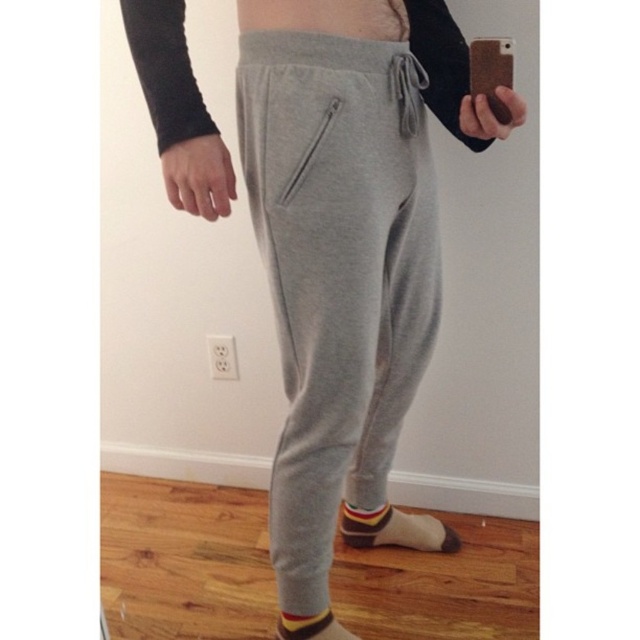
You are a photographer adjusting the camera focus for the person in the image. The person has two points of interest at point coordinates point (282, 266) and point (305, 138). Which point should you focus on first to ensure the closest object is sharp?

Point (282, 266) is closer to the viewer than point (305, 138), so you should focus on point (282, 266) first to ensure the closest object is sharp.

You are a photographer trying to capture the perfect selfie. You notice two points marked in the image. The first point is at coordinates point (x=289, y=573) and the second point is at point (x=320, y=156). Based on their positions, which point is closer to the camera?

Point (x=320, y=156) is closer to the camera since it is in front of point (x=289, y=573) according to the description.

Based on the scene description, which object is wider between the heather gray sweatpants at center and the multicolored knit sock at lower center?

The heather gray sweatpants at center is wider than the multicolored knit sock at lower center according to the description.